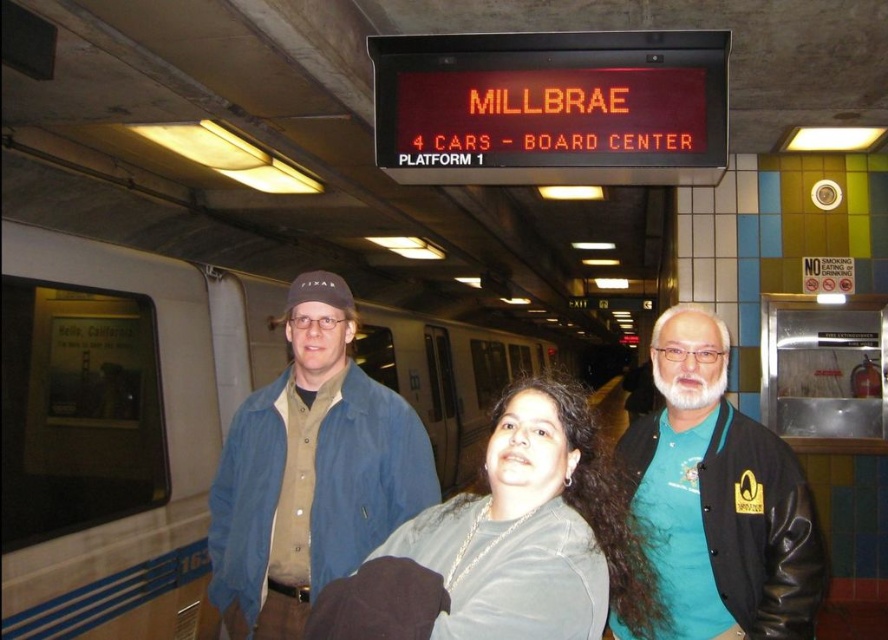
Identify the location of silver metallic train at center. (165, 440).

Does silver metallic train at center appear on the left side of gray matte shirt at center?

Indeed, silver metallic train at center is positioned on the left side of gray matte shirt at center.

Identify the location of silver metallic train at center. This screenshot has width=888, height=640. (165, 440).

Between denim jacket at center and black leather jacket at right, which one is positioned higher?

black leather jacket at right

Does point (258, 621) come in front of point (799, 513)?

No.

Locate an element on the screen. denim jacket at center is located at coordinates [310, 472].

Can you confirm if silver metallic train at center is wider than denim jacket at center?

Yes.

Can you confirm if silver metallic train at center is thinner than denim jacket at center?

Incorrect, silver metallic train at center's width is not less than denim jacket at center's.

Identify the location of silver metallic train at center. The image size is (888, 640). (165, 440).